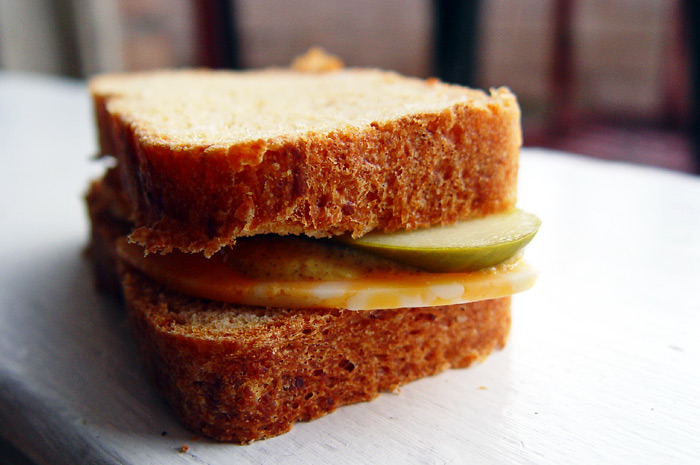
The height and width of the screenshot is (465, 700). In order to click on sunlight hitting the table in this screenshot , I will do `click(631, 320)`.